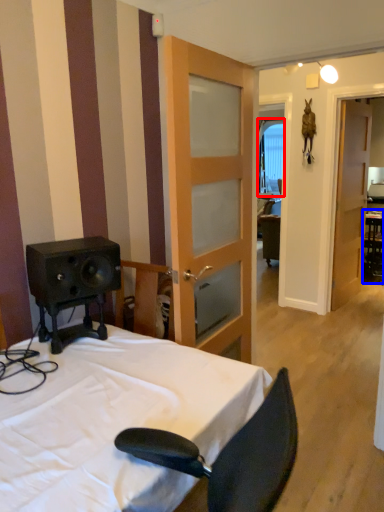
Question: Among these objects, which one is farthest to the camera, window (highlighted by a red box) or table (highlighted by a blue box)?

Choices:
 (A) window
 (B) table

Answer: (A)